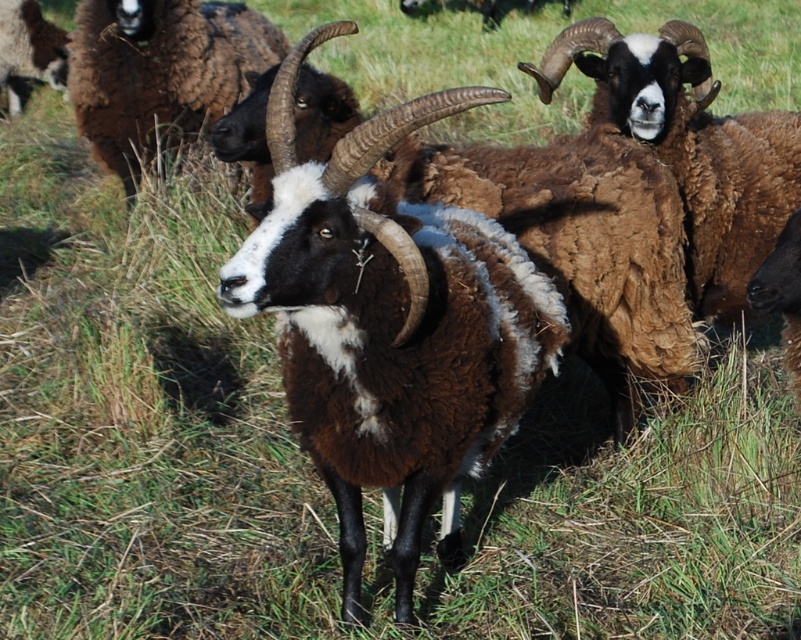
Does point (632, 54) come behind point (18, 58)?

No, it is not.

Describe the element at coordinates (690, 147) in the screenshot. I see `brown woolly ram at upper right` at that location.

This screenshot has width=801, height=640. In order to click on brown woolly ram at upper right in this screenshot , I will do `click(690, 147)`.

Can you confirm if brown woolly goat at center is taller than brown woolly goat at upper left?

Incorrect, brown woolly goat at center's height is not larger of brown woolly goat at upper left's.

Does point (272, 237) come closer to viewer compared to point (151, 19)?

That is True.

The width and height of the screenshot is (801, 640). What are the coordinates of `brown woolly goat at center` in the screenshot? It's located at (389, 324).

Which is more to the right, brown woolly goat at center or brown woolly ram at upper right?

brown woolly ram at upper right is more to the right.

Who is more forward, (469, 410) or (787, 164)?

Point (469, 410) is more forward.

Describe the element at coordinates (389, 324) in the screenshot. This screenshot has width=801, height=640. I see `brown woolly goat at center` at that location.

Image resolution: width=801 pixels, height=640 pixels. Identify the location of brown woolly goat at center. (389, 324).